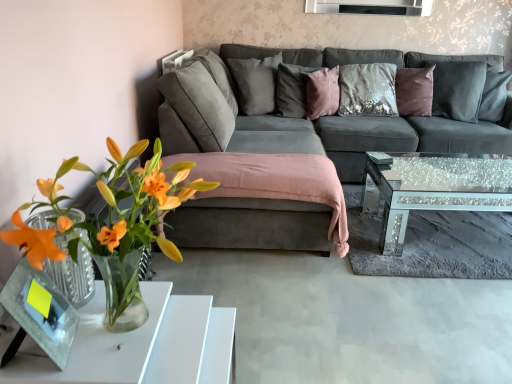
Question: Considering the relative sizes of translucent glass vase at lower left and sparkly glass coffee table at center in the image provided, is translucent glass vase at lower left shorter than sparkly glass coffee table at center?

Choices:
 (A) no
 (B) yes

Answer: (A)

Question: Is there a large distance between translucent glass vase at lower left and sparkly glass coffee table at center?

Choices:
 (A) yes
 (B) no

Answer: (A)

Question: Is translucent glass vase at lower left smaller than sparkly glass coffee table at center?

Choices:
 (A) no
 (B) yes

Answer: (B)

Question: Is translucent glass vase at lower left closer to the viewer compared to sparkly glass coffee table at center?

Choices:
 (A) no
 (B) yes

Answer: (B)

Question: Is sparkly glass coffee table at center at the back of translucent glass vase at lower left?

Choices:
 (A) yes
 (B) no

Answer: (B)

Question: Visually, is satin gray pillow at upper center, acting as the 4th pillow starting from the right, positioned to the left or to the right of sparkly glass coffee table at center?

Choices:
 (A) right
 (B) left

Answer: (B)

Question: Considering the positions of satin gray pillow at upper center, which is the 1th pillow from left to right, and sparkly glass coffee table at center in the image, is satin gray pillow at upper center, which is the 1th pillow from left to right, bigger or smaller than sparkly glass coffee table at center?

Choices:
 (A) small
 (B) big

Answer: (A)

Question: From their relative heights in the image, would you say satin gray pillow at upper center, which is the 1th pillow from left to right, is taller or shorter than sparkly glass coffee table at center?

Choices:
 (A) short
 (B) tall

Answer: (B)

Question: Is point (228, 66) closer or farther from the camera than point (419, 177)?

Choices:
 (A) farther
 (B) closer

Answer: (A)

Question: From the image's perspective, is velvet purple pillow at upper right, which is the 4th pillow in left-to-right order, located above or below white glossy table at lower left?

Choices:
 (A) above
 (B) below

Answer: (A)

Question: In the image, is velvet purple pillow at upper right, which is the 4th pillow in left-to-right order, on the left side or the right side of white glossy table at lower left?

Choices:
 (A) left
 (B) right

Answer: (B)

Question: In terms of width, does velvet purple pillow at upper right, acting as the 1th pillow starting from the right, look wider or thinner when compared to white glossy table at lower left?

Choices:
 (A) wide
 (B) thin

Answer: (B)

Question: Looking at the image, does velvet purple pillow at upper right, which is the 4th pillow in left-to-right order, seem bigger or smaller compared to white glossy table at lower left?

Choices:
 (A) big
 (B) small

Answer: (A)

Question: Considering the positions of satin gray pillow at upper center, which is the 1th pillow from left to right, and pink velvet pillow at center, which is the third pillow in right-to-left order, in the image, is satin gray pillow at upper center, which is the 1th pillow from left to right, taller or shorter than pink velvet pillow at center, which is the third pillow in right-to-left order,?

Choices:
 (A) tall
 (B) short

Answer: (A)

Question: In the image, is satin gray pillow at upper center, acting as the 4th pillow starting from the right, positioned in front of or behind pink velvet pillow at center, which is the third pillow in right-to-left order?

Choices:
 (A) front
 (B) behind

Answer: (A)